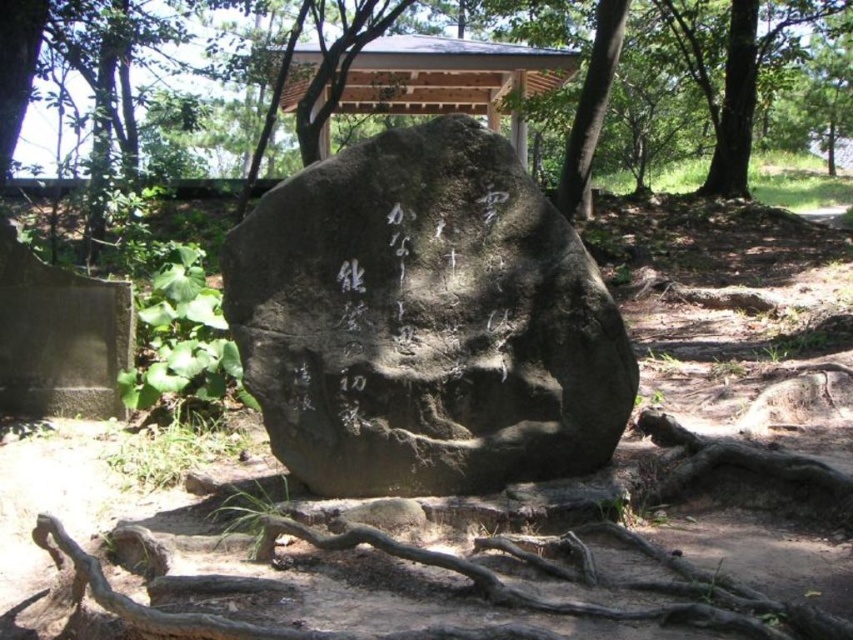
In the scene shown: You are standing in the park and want to take a photo of the green leafy tree at center and the brown rough tree roots at lower center. Which one should you focus on first to ensure both are in sharp focus?

You should focus on the green leafy tree at center first because it is closer to you than the brown rough tree roots at lower center, so focusing on the closer object will help both be in focus.

You are standing in the park and see the dark gray stone at center and the brown rough tree roots at lower center. Which object is located to the left of the other?

The dark gray stone at center is positioned on the left side of brown rough tree roots at lower center.

You are standing in front of the large gray boulder with the white calligraphy. There are two points marked on the rock surface at coordinates point (572, 435) and point (593, 20). Which of these points is nearer to your viewpoint?

Point (572, 435) is closer to the camera than point (593, 20), so the point at (572, 435) is nearer to your viewpoint.